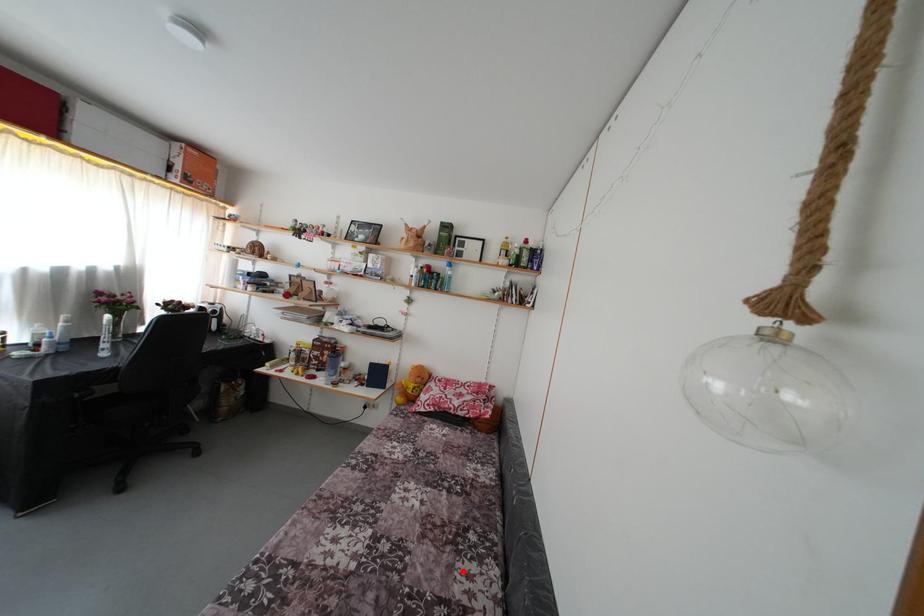
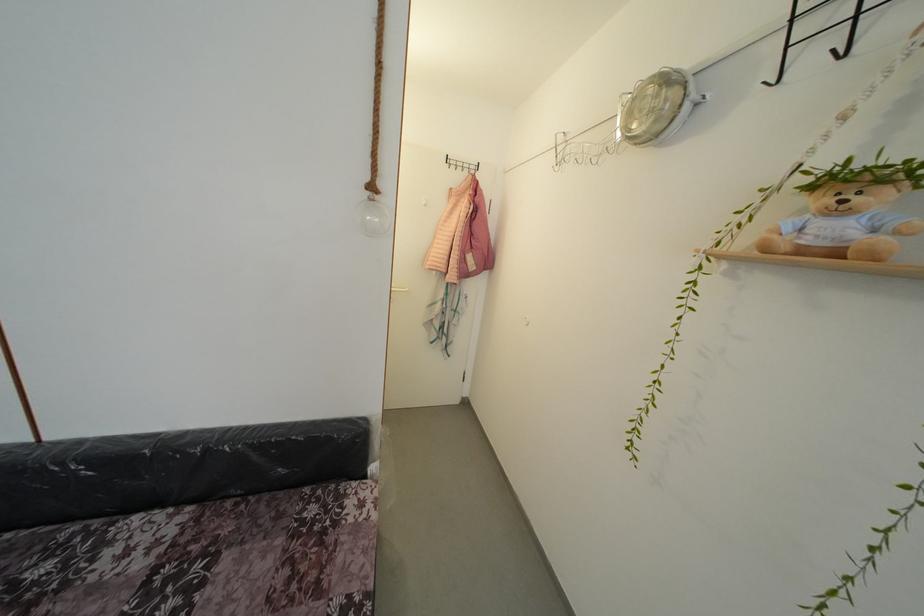
The point at the highlighted location is marked in the first image. Where is the corresponding point in the second image?

(99, 585)